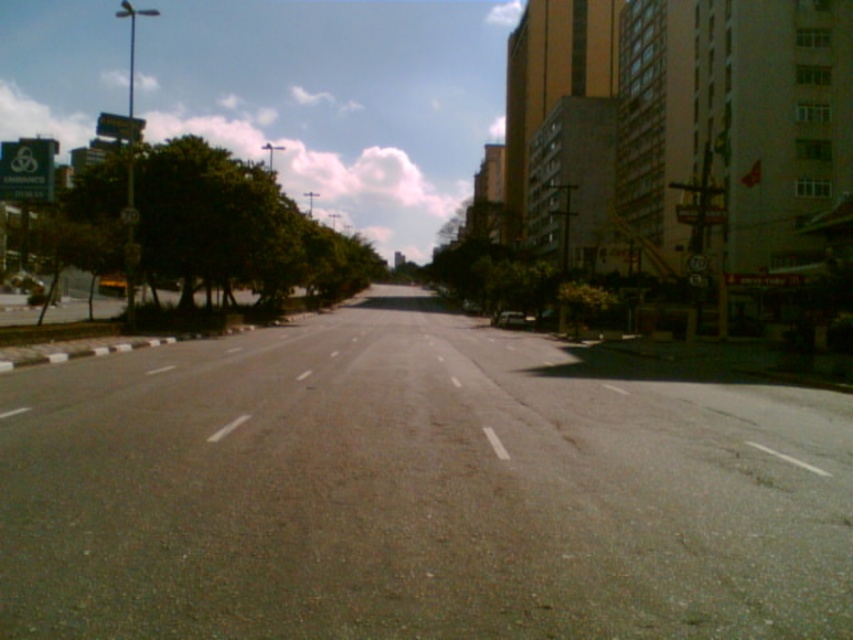
Question: Which object is closer to the camera taking this photo?

Choices:
 (A) green leafy tree at left
 (B) metallic silver car at center

Answer: (A)

Question: Does green leafy tree at left appear under metallic silver car at center?

Choices:
 (A) yes
 (B) no

Answer: (B)

Question: In this image, where is green leafy tree at left located relative to metallic silver car at center?

Choices:
 (A) above
 (B) below

Answer: (A)

Question: Can you confirm if green leafy tree at left is bigger than metallic silver car at center?

Choices:
 (A) yes
 (B) no

Answer: (A)

Question: Among these objects, which one is nearest to the camera?

Choices:
 (A) green leafy tree at left
 (B) metallic silver car at center

Answer: (A)

Question: Among these objects, which one is nearest to the camera?

Choices:
 (A) metallic silver car at center
 (B) green leafy tree at left

Answer: (B)